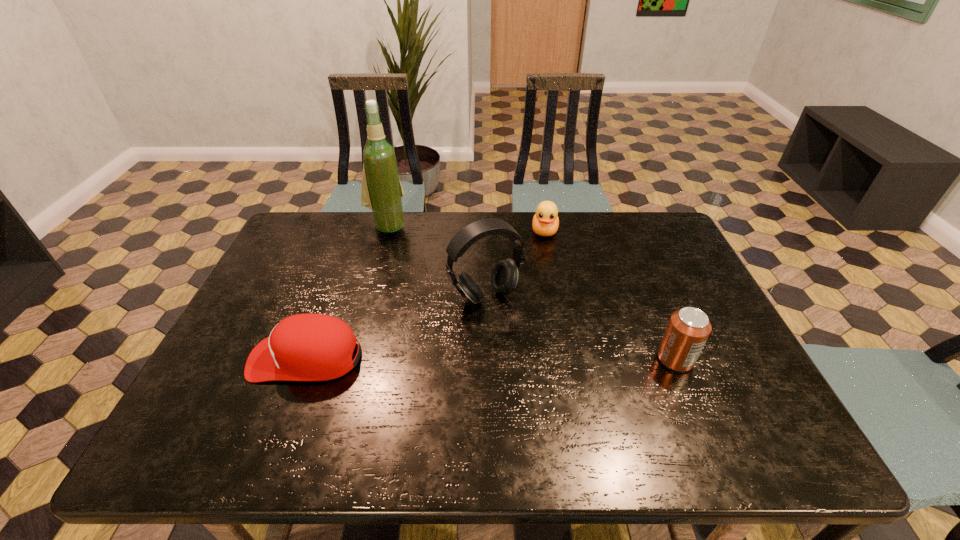
Find the location of a particular element. vacant area between the third object from left to right and the rightmost object is located at coordinates (581, 327).

The height and width of the screenshot is (540, 960). In order to click on free space between the wine bottle and the fourth shortest object in this screenshot , I will do `click(436, 261)`.

Where is `free space between the third shortest object and the wine bottle`? The height and width of the screenshot is (540, 960). free space between the third shortest object and the wine bottle is located at coordinates (531, 292).

Where is `free space between the can and the wine bottle`? This screenshot has width=960, height=540. free space between the can and the wine bottle is located at coordinates (531, 292).

Identify which object is the nearest to the baseball cap. Please provide its 2D coordinates. Your answer should be formatted as a tuple, i.e. [(x, y)], where the tuple contains the x and y coordinates of a point satisfying the conditions above.

[(504, 277)]

Point out which object is positioned as the nearest to the wine bottle. Please provide its 2D coordinates. Your answer should be formatted as a tuple, i.e. [(x, y)], where the tuple contains the x and y coordinates of a point satisfying the conditions above.

[(504, 277)]